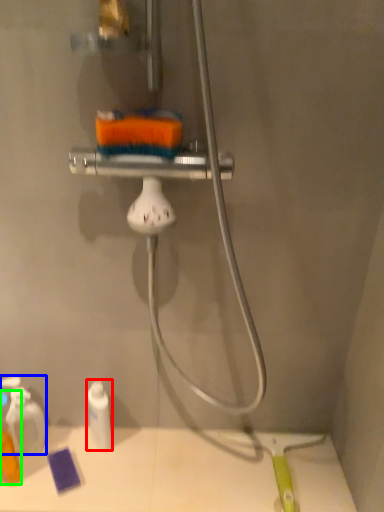
Question: Which is nearer to the toiletry (highlighted by a red box)? toiletry (highlighted by a blue box) or toiletry (highlighted by a green box).

Choices:
 (A) toiletry
 (B) toiletry

Answer: (A)